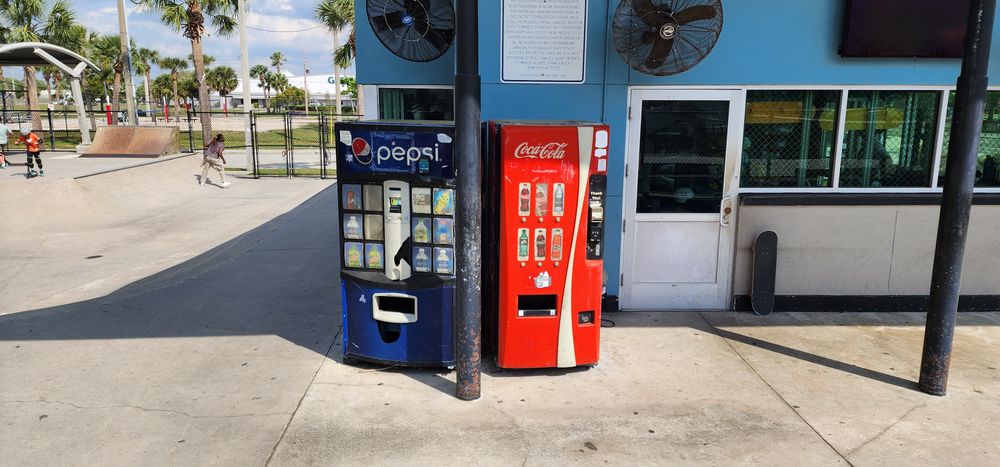
Locate an element on the screen. The height and width of the screenshot is (467, 1000). fan is located at coordinates (402, 19), (646, 26).